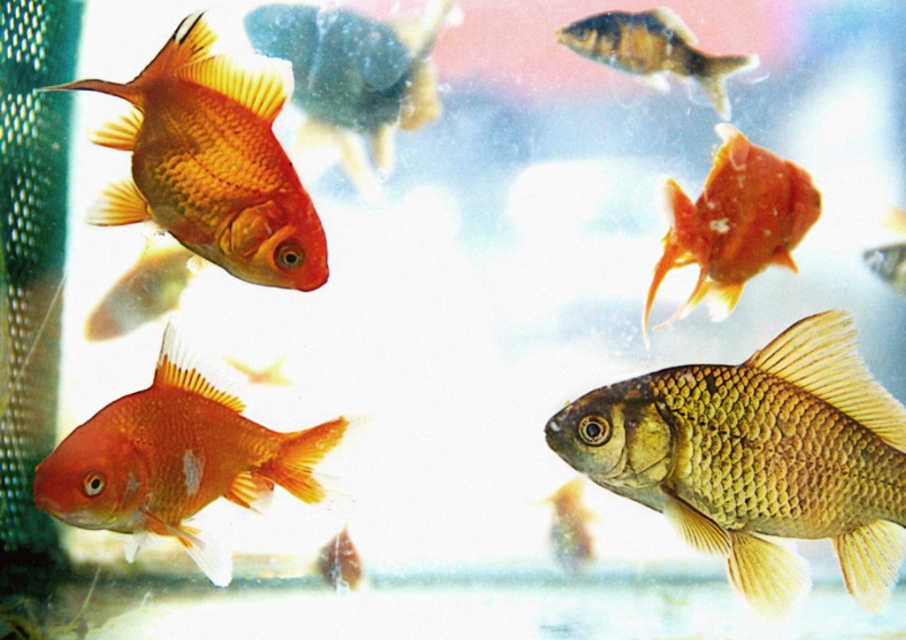
Question: Which object is closer to the camera taking this photo?

Choices:
 (A) shiny golden fish at center
 (B) brown textured fish at upper center

Answer: (A)

Question: Where is matte orange goldfish at lower left located in relation to shiny orange goldfish at upper right in the image?

Choices:
 (A) right
 (B) left

Answer: (B)

Question: Is matte orange goldfish at lower left further to the viewer compared to brown textured fish at upper center?

Choices:
 (A) yes
 (B) no

Answer: (B)

Question: From the image, what is the correct spatial relationship of matte goldfish at left in relation to brown textured fish at upper center?

Choices:
 (A) below
 (B) above

Answer: (A)

Question: Among these points, which one is farthest from the camera?

Choices:
 (A) (143, 484)
 (B) (182, 180)

Answer: (A)

Question: Which point is farther to the camera?

Choices:
 (A) matte orange goldfish at lower left
 (B) matte goldfish at left
 (C) shiny golden fish at center
 (D) brown textured fish at upper center

Answer: (D)